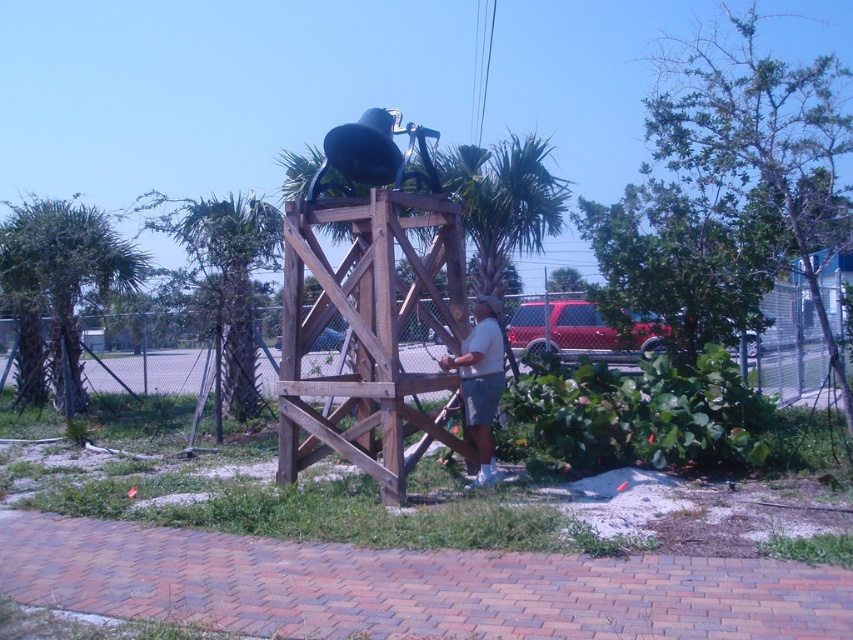
Question: Which is nearer to the white cotton shirt at center?

Choices:
 (A) green leafy palm tree at left
 (B) green leafy palm tree at center

Answer: (B)

Question: Which is nearer to the green leafy palm tree at left?

Choices:
 (A) white cotton shirt at center
 (B) green leafy palm tree at center

Answer: (B)

Question: Can you confirm if green leafy palm tree at left is positioned to the left of green leafy palm tree at center?

Choices:
 (A) no
 (B) yes

Answer: (B)

Question: Estimate the real-world distances between objects in this image. Which object is closer to the green leafy palm tree at center?

Choices:
 (A) green leafy palm tree at left
 (B) white cotton shirt at center

Answer: (A)

Question: Does green leafy palm tree at center have a greater width compared to white cotton shirt at center?

Choices:
 (A) no
 (B) yes

Answer: (B)

Question: Can you confirm if green leafy palm tree at center is bigger than white cotton shirt at center?

Choices:
 (A) no
 (B) yes

Answer: (B)